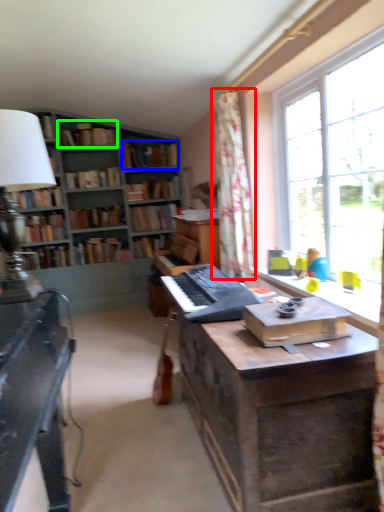
Question: Estimate the real-world distances between objects in this image. Which object is farther from curtain (highlighted by a red box), book (highlighted by a blue box) or book (highlighted by a green box)?

Choices:
 (A) book
 (B) book

Answer: (B)